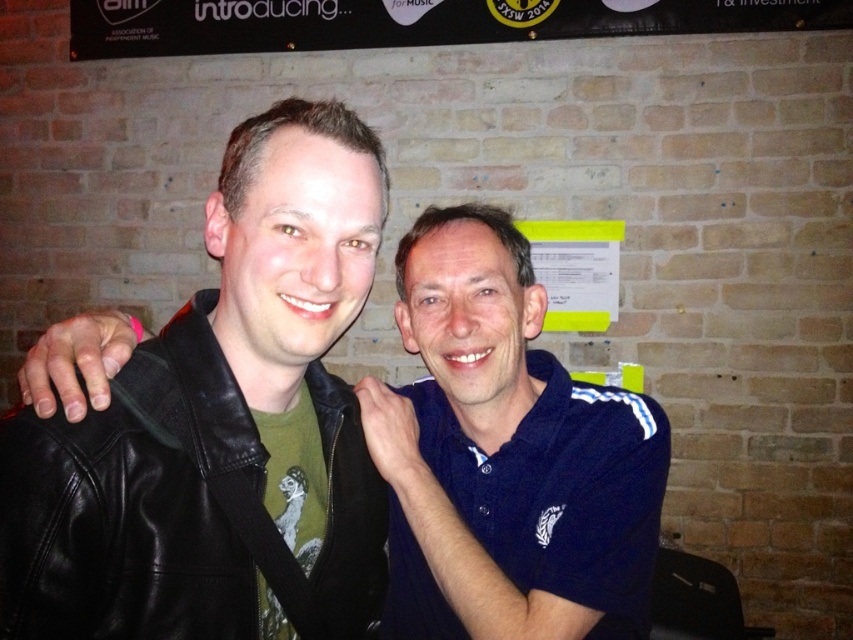
Does black leather jacket at center lie behind black plastic banner at upper center?

No, it is not.

Is point (178, 428) behind point (180, 45)?

That is False.

Is point (231, 451) farther from viewer compared to point (399, 44)?

No, (231, 451) is closer to viewer.

Identify the location of black leather jacket at center. Image resolution: width=853 pixels, height=640 pixels. (219, 426).

Does black leather jacket at center have a lesser width compared to blue cotton polo shirt at center?

Correct, black leather jacket at center's width is less than blue cotton polo shirt at center's.

Image resolution: width=853 pixels, height=640 pixels. What are the coordinates of `black leather jacket at center` in the screenshot? It's located at (219, 426).

Find the location of a particular element. The image size is (853, 640). black leather jacket at center is located at coordinates (219, 426).

The width and height of the screenshot is (853, 640). I want to click on black leather jacket at center, so click(219, 426).

Is black leather jacket at left above blue cotton polo shirt at center?

Correct, black leather jacket at left is located above blue cotton polo shirt at center.

Can you confirm if black leather jacket at left is shorter than blue cotton polo shirt at center?

In fact, black leather jacket at left may be taller than blue cotton polo shirt at center.

This screenshot has width=853, height=640. Describe the element at coordinates (506, 456) in the screenshot. I see `black leather jacket at left` at that location.

Where is `black leather jacket at left`? The height and width of the screenshot is (640, 853). black leather jacket at left is located at coordinates (506, 456).